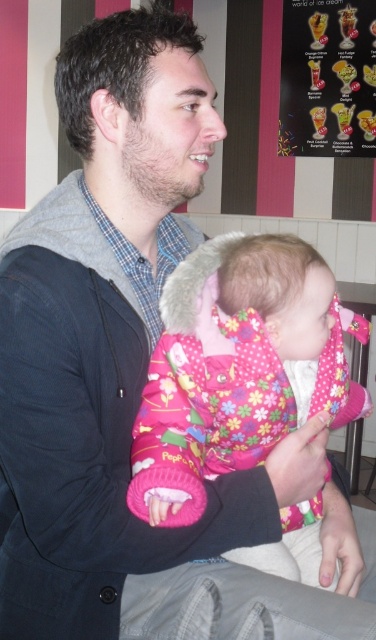
You are a photographer trying to capture the fluffy pink jacket at center and the vibrant plastic ice cream cones at upper right in the same frame. Based on their sizes in the image, which object would appear smaller in the final photo?

The fluffy pink jacket at center appears smaller in the photo because it has a lesser width compared to the vibrant plastic ice cream cones at upper right.

You are standing in an ice cream shop and see two points marked on the floor. The first point is at coordinates point (x=165, y=480) and the second is at point (x=295, y=122). If you want to walk towards the point that is closer to the entrance, which coordinate should you head towards?

Point (x=165, y=480) is in front of point (x=295, y=122), so the entrance is likely closer to point (x=165, y=480). You should head towards point (x=165, y=480).